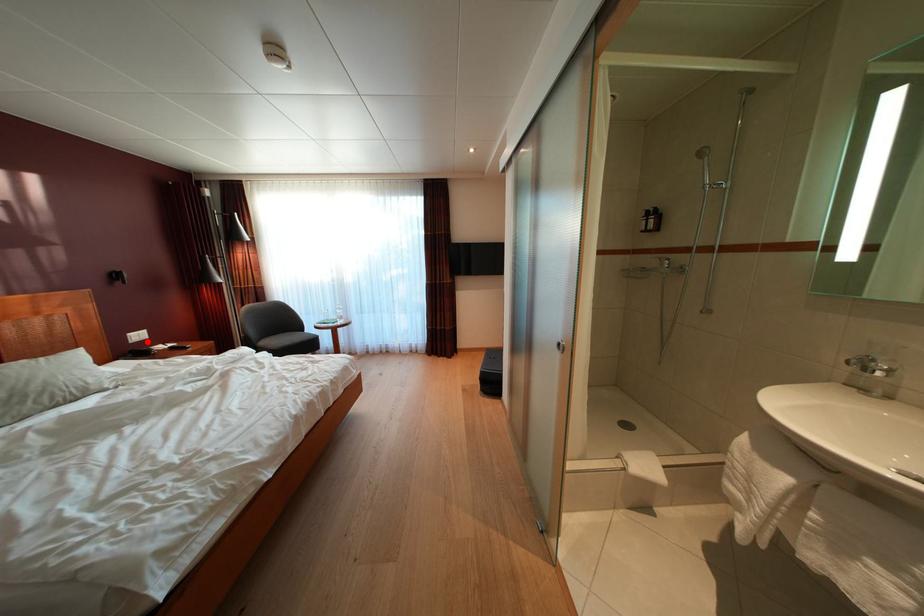
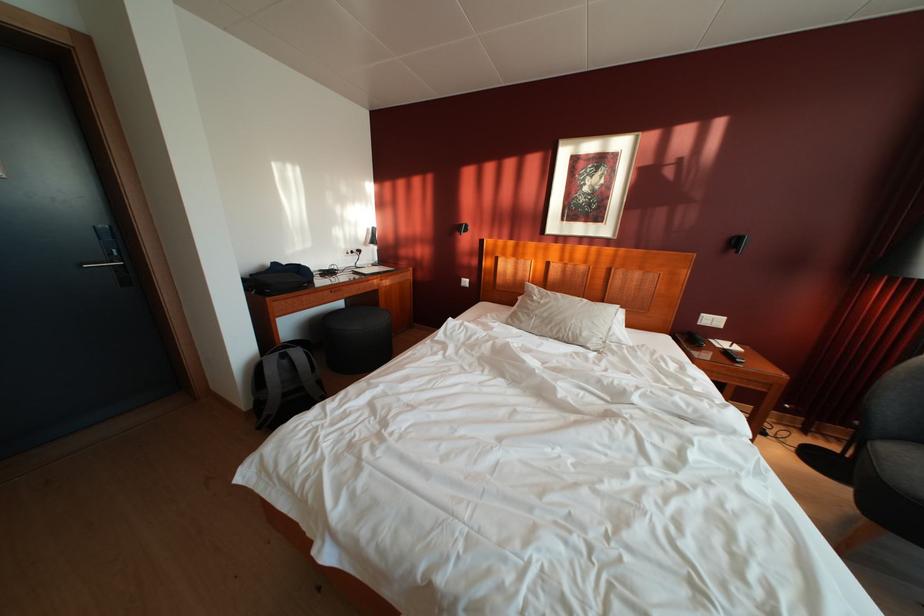
In the second image, find the point that corresponds to the highlighted location in the first image.

(721, 326)